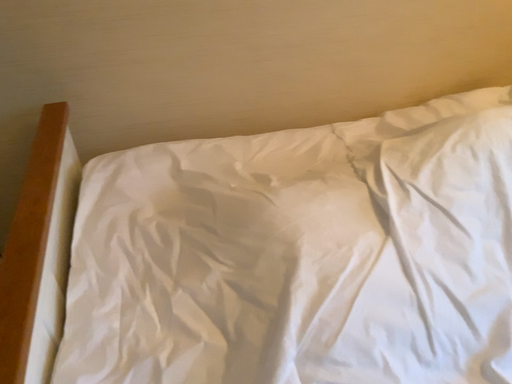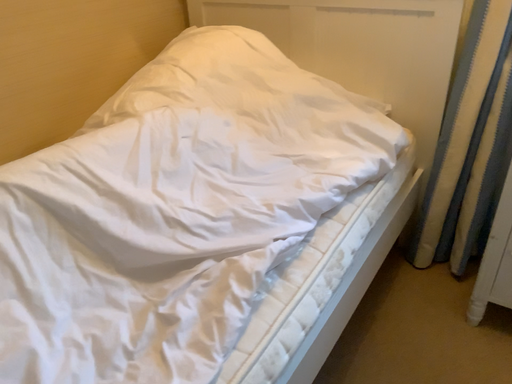
Question: Which way did the camera rotate in the video?

Choices:
 (A) rotated upward
 (B) rotated downward

Answer: (A)